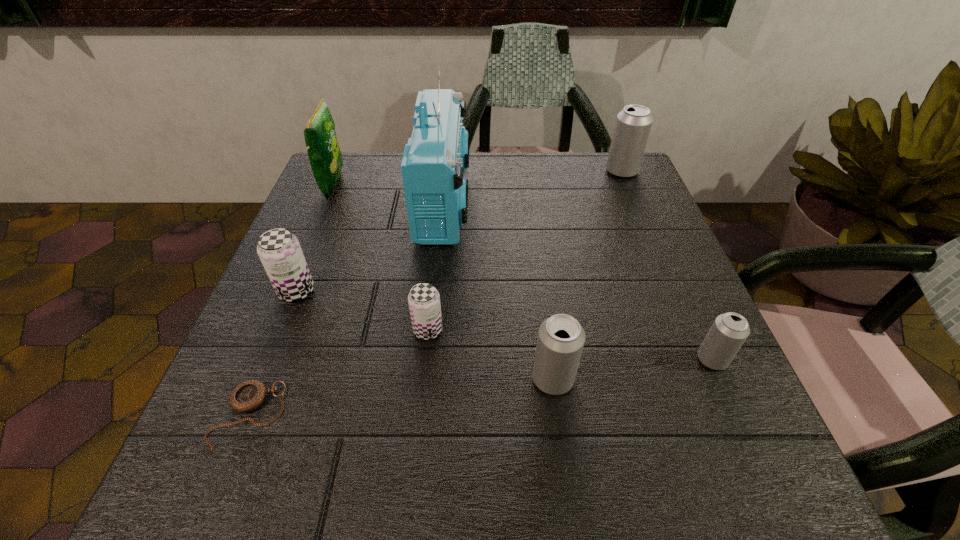
Where is `blue radio receiver`? The width and height of the screenshot is (960, 540). blue radio receiver is located at coordinates (435, 157).

The width and height of the screenshot is (960, 540). I want to click on the tallest object, so click(x=435, y=157).

At what (x,y) coordinates should I click in order to perform the action: click on green crisp (potato chip). Please return your answer as a coordinate pair (x, y). Looking at the image, I should click on (325, 157).

What are the coordinates of `the biggest white beer can` in the screenshot? It's located at (633, 124).

You are a GUI agent. You are given a task and a screenshot of the screen. Output one action in this format:
    pyautogui.click(x=<x>, y=<y>)
    Task: Click on the farthest white beer can
    
    Given the screenshot: What is the action you would take?
    tap(633, 124)

This screenshot has width=960, height=540. In order to click on the farther purple beer can in this screenshot , I will do `click(279, 250)`.

The width and height of the screenshot is (960, 540). In order to click on the second farthest beer can in this screenshot , I will do `click(279, 250)`.

At what (x,y) coordinates should I click in order to perform the action: click on the third object from right to left. Please return your answer as a coordinate pair (x, y). Looking at the image, I should click on (561, 338).

Locate an element on the screen. the third beer can from left to right is located at coordinates (561, 338).

Find the location of a particular element. This screenshot has height=540, width=960. the fourth nearest object is located at coordinates pyautogui.click(x=424, y=300).